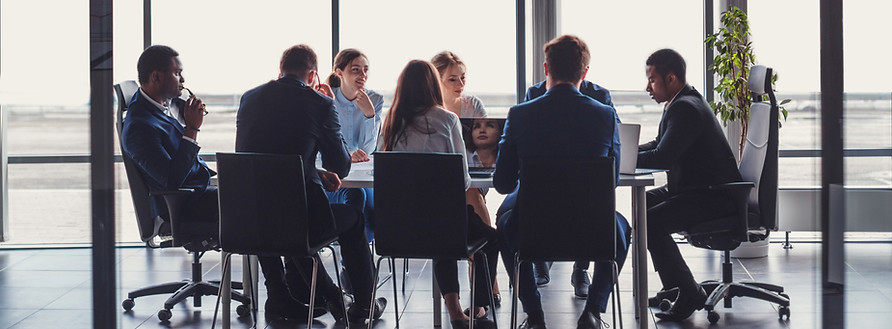
Where is `black window dividers`? The width and height of the screenshot is (892, 329). black window dividers is located at coordinates (147, 28), (333, 31), (65, 160), (212, 157), (518, 38), (707, 34), (805, 147), (830, 157), (104, 207).